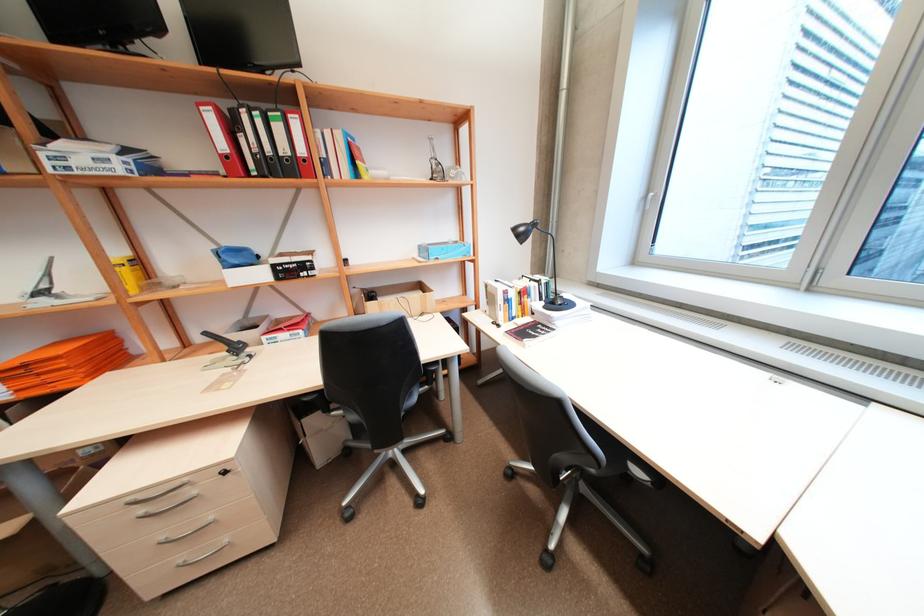
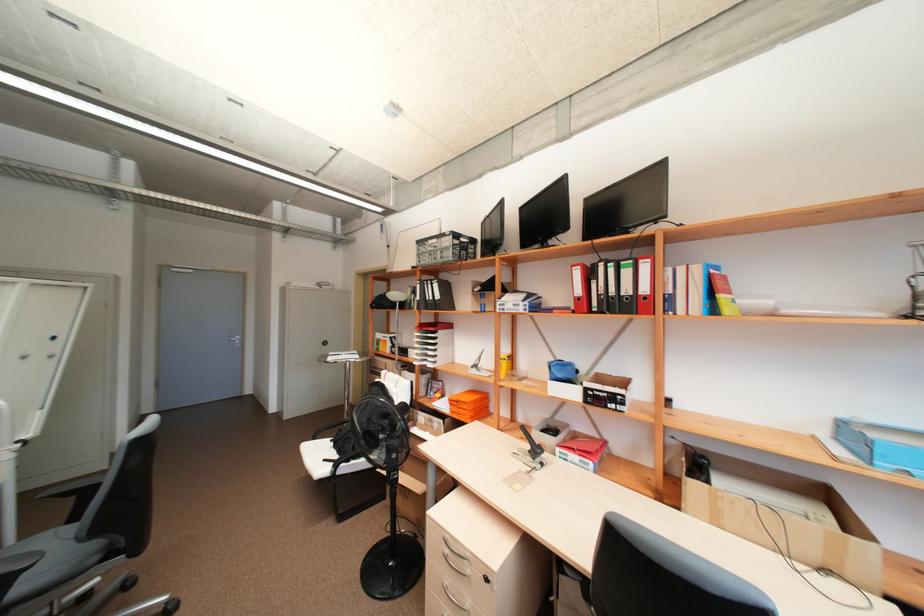
Locate, in the second image, the point that corresponds to pixel 132 273 in the first image.

(511, 363)